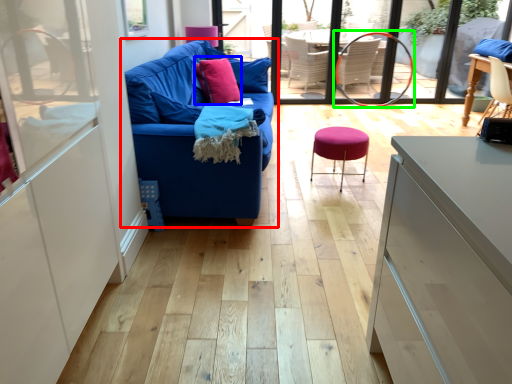
Question: Based on their relative distances, which object is nearer to studio couch (highlighted by a red box)? Choose from throw pillow (highlighted by a blue box) and armchair (highlighted by a green box).

Choices:
 (A) throw pillow
 (B) armchair

Answer: (A)